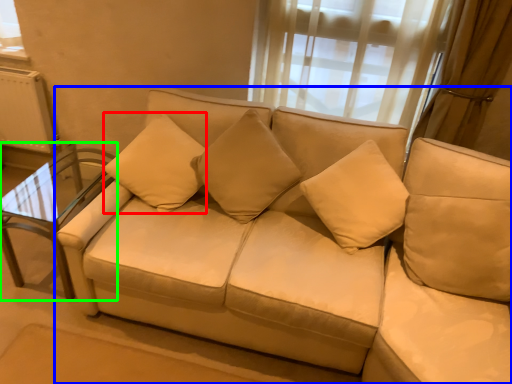
Question: Estimate the real-world distances between objects in this image. Which object is farther from pillow (highlighted by a red box), studio couch (highlighted by a blue box) or table (highlighted by a green box)?

Choices:
 (A) studio couch
 (B) table

Answer: (A)